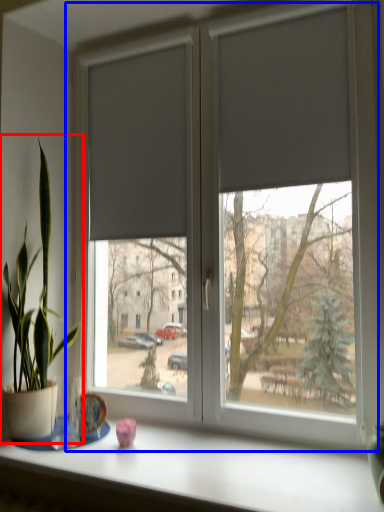
Question: Which object appears closest to the camera in this image, houseplant (highlighted by a red box) or window (highlighted by a blue box)?

Choices:
 (A) houseplant
 (B) window

Answer: (B)